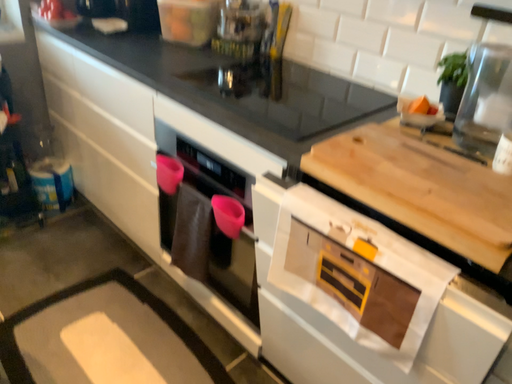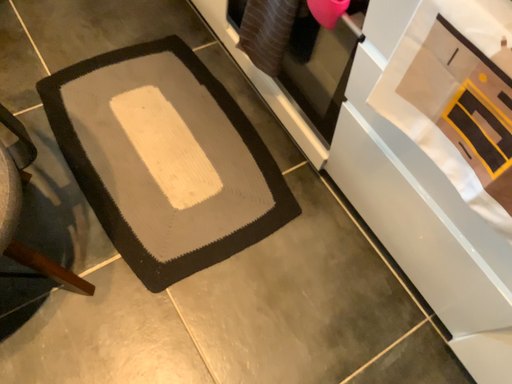
Question: How did the camera likely rotate when shooting the video?

Choices:
 (A) rotated upward
 (B) rotated downward

Answer: (B)